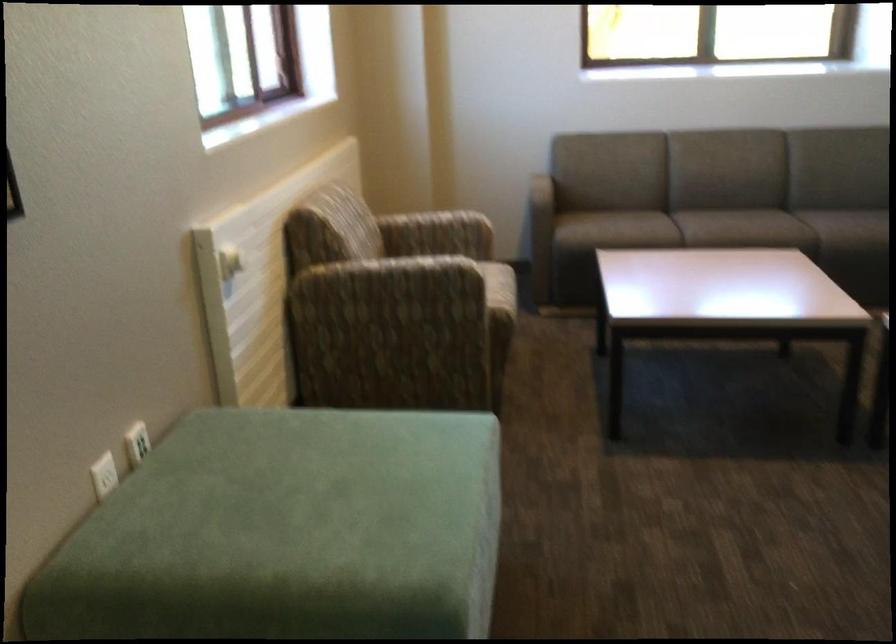
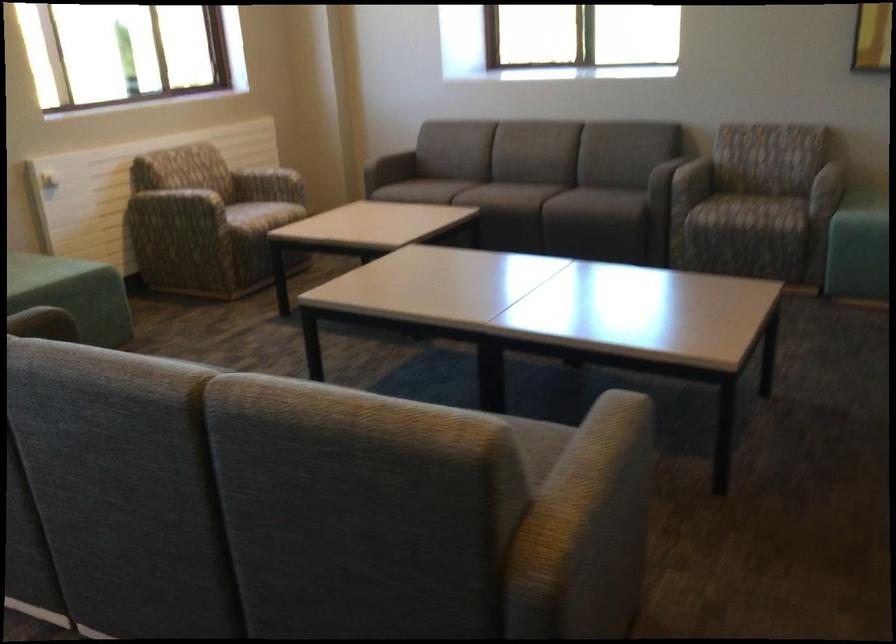
Question: The images are taken continuously from a first-person perspective. In which direction are you moving?

Choices:
 (A) Left
 (B) Right
 (C) Forward
 (D) Backward

Answer: (B)